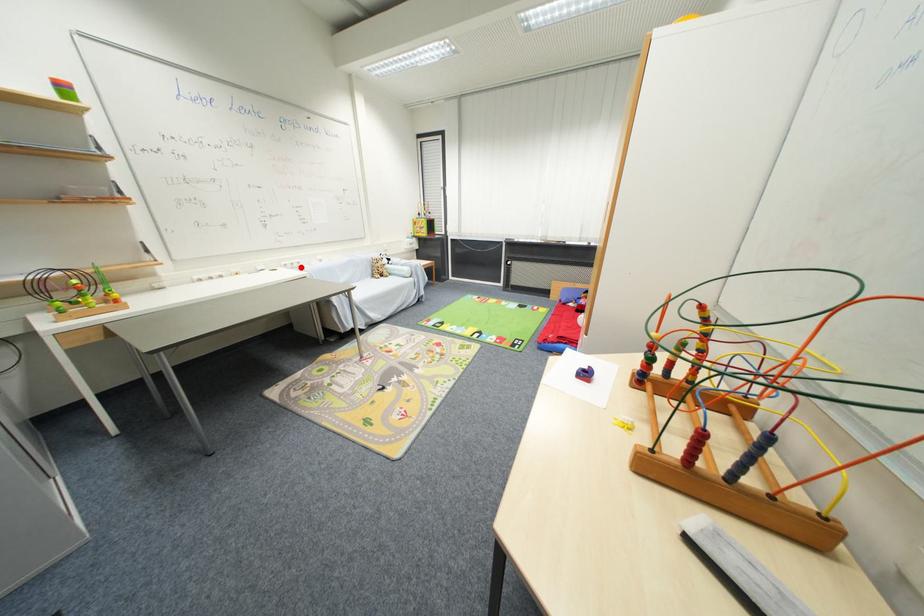
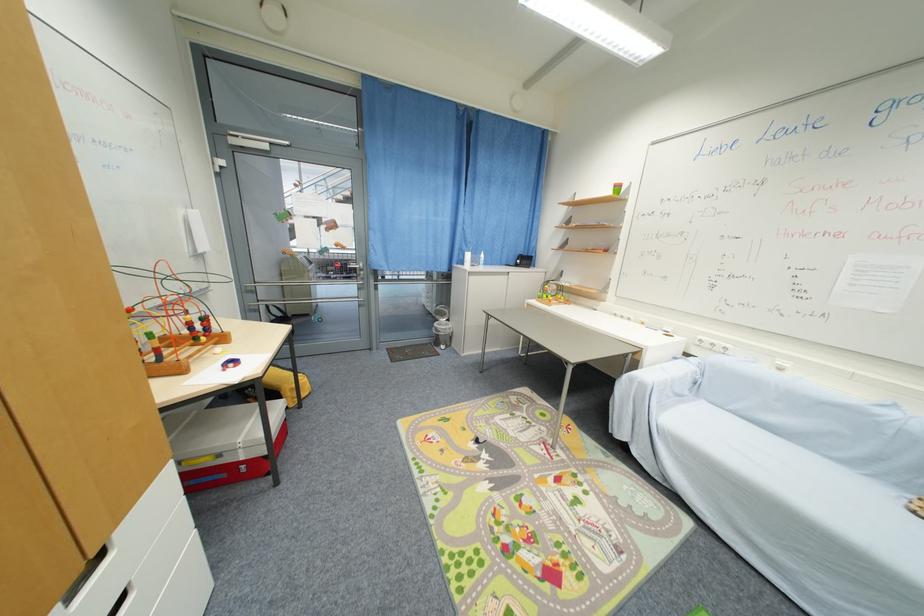
Where in the second image is the point corresponding to the highlighted location from the first image?

(723, 351)